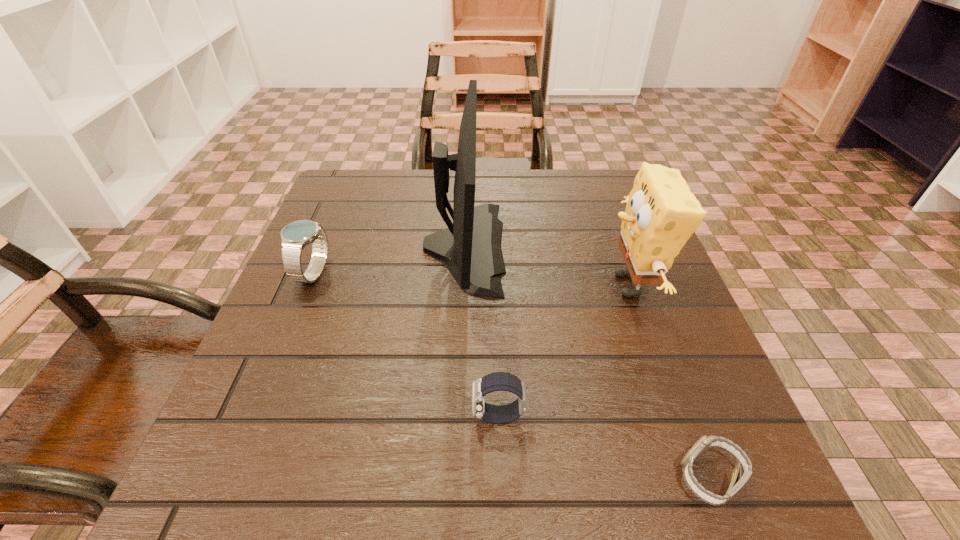
At what (x,y) coordinates should I click in order to perform the action: click on the tallest object. Please return your answer as a coordinate pair (x, y). Looking at the image, I should click on (470, 248).

I want to click on the second tallest object, so click(661, 214).

Identify the location of the leftmost watch. (295, 236).

This screenshot has height=540, width=960. What are the coordinates of `the third shortest object` in the screenshot? It's located at (295, 236).

Identify the location of the fourth tallest object. Image resolution: width=960 pixels, height=540 pixels. (497, 381).

Find the location of a particular element. This screenshot has height=540, width=960. the second farthest watch is located at coordinates (497, 381).

In order to click on the rightmost watch in this screenshot , I will do `click(705, 443)`.

Image resolution: width=960 pixels, height=540 pixels. Find the location of `the nearest object`. the nearest object is located at coordinates (705, 443).

Image resolution: width=960 pixels, height=540 pixels. What are the coordinates of `vacant region located on the screen side of the tallest object` in the screenshot? It's located at (655, 247).

In order to click on blank space located on the face of the second tallest object in this screenshot , I will do `click(475, 285)`.